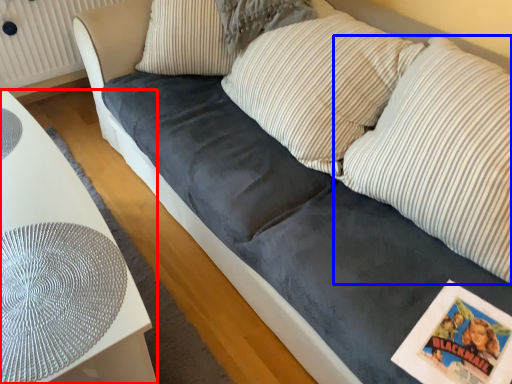
Question: Among these objects, which one is nearest to the camera, furniture (highlighted by a red box) or pillow (highlighted by a blue box)?

Choices:
 (A) furniture
 (B) pillow

Answer: (B)